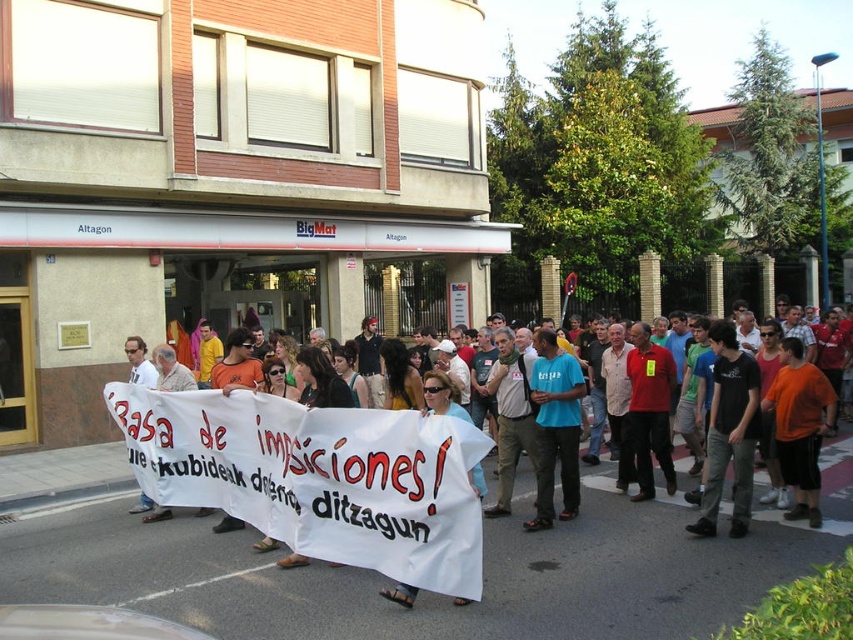
You are a photographer at the protest, and you want to capture a photo that includes both the white fabric banner at center and the orange cotton shirt at center. Based on their positions, which object should be placed on the left side of the photo to ensure both are visible?

The white fabric banner at center should be placed on the left side of the photo since it is already to the left of the orange cotton shirt at center in the scene.